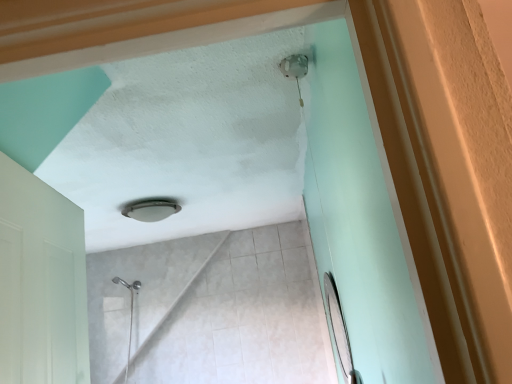
Identify the location of matte silver mirror at right. The width and height of the screenshot is (512, 384). (339, 329).

What is the approximate width of matte silver mirror at right?

It is 2.90 inches.

What do you see at coordinates (339, 329) in the screenshot? The height and width of the screenshot is (384, 512). I see `matte silver mirror at right` at bounding box center [339, 329].

What do you see at coordinates (151, 210) in the screenshot? I see `matte glass lamp at center` at bounding box center [151, 210].

Where is `matte glass lamp at center`? This screenshot has height=384, width=512. matte glass lamp at center is located at coordinates (151, 210).

This screenshot has width=512, height=384. I want to click on matte silver mirror at right, so click(339, 329).

Which is more to the left, matte glass lamp at center or matte silver mirror at right?

matte glass lamp at center is more to the left.

Considering the positions of objects matte glass lamp at center and matte silver mirror at right in the image provided, who is behind, matte glass lamp at center or matte silver mirror at right?

matte glass lamp at center is behind.

Which is closer to the camera, [138,212] or [337,320]?

The point [337,320] is in front.

From the image's perspective, who appears lower, matte glass lamp at center or matte silver mirror at right?

From the image's view, matte silver mirror at right is below.

In the scene shown: From a real-world perspective, is matte glass lamp at center physically located above or below matte silver mirror at right?

From a real-world perspective, matte glass lamp at center is physically above matte silver mirror at right.

Considering the sizes of objects matte glass lamp at center and matte silver mirror at right in the image provided, who is wider, matte glass lamp at center or matte silver mirror at right?

With larger width is matte glass lamp at center.

Is matte glass lamp at center taller than matte silver mirror at right?

No, matte glass lamp at center is not taller than matte silver mirror at right.

Considering the relative sizes of matte glass lamp at center and matte silver mirror at right in the image provided, is matte glass lamp at center bigger than matte silver mirror at right?

Incorrect, matte glass lamp at center is not larger than matte silver mirror at right.

Is matte glass lamp at center outside of matte silver mirror at right?

Absolutely, matte glass lamp at center is external to matte silver mirror at right.

Can you see matte glass lamp at center touching matte silver mirror at right?

matte glass lamp at center and matte silver mirror at right are clearly separated.

Is matte glass lamp at center oriented away from matte silver mirror at right?

That's not correct — matte glass lamp at center is not looking away from matte silver mirror at right.

Can you tell me how much matte glass lamp at center and matte silver mirror at right differ in facing direction?

The facing directions of matte glass lamp at center and matte silver mirror at right are 91.5 degrees apart.

How far apart are matte glass lamp at center and matte silver mirror at right?

matte glass lamp at center is 1.03 meters away from matte silver mirror at right.

Locate an element on the screen. lamp that is above the matte silver mirror at right (from the image's perspective) is located at coordinates (151, 210).

Is matte silver mirror at right to the left or to the right of matte glass lamp at center in the image?

Based on their positions, matte silver mirror at right is located to the right of matte glass lamp at center.

From the picture: Does matte silver mirror at right lie in front of matte glass lamp at center?

That is True.

Is point (350, 377) behind point (170, 212)?

No, (350, 377) is in front of (170, 212).

From the image's perspective, is matte silver mirror at right over matte glass lamp at center?

Incorrect, from the image's perspective, matte silver mirror at right is lower than matte glass lamp at center.

From a real-world perspective, does matte silver mirror at right stand above matte glass lamp at center?

No, from a real-world perspective, matte silver mirror at right is not over matte glass lamp at center

Does matte silver mirror at right have a greater width compared to matte glass lamp at center?

No, matte silver mirror at right is not wider than matte glass lamp at center.

In terms of height, does matte silver mirror at right look taller or shorter compared to matte glass lamp at center?

Clearly, matte silver mirror at right is taller compared to matte glass lamp at center.

Based on the photo, considering the sizes of objects matte silver mirror at right and matte glass lamp at center in the image provided, who is smaller, matte silver mirror at right or matte glass lamp at center?

matte glass lamp at center is smaller.

Is matte silver mirror at right outside of matte glass lamp at center?

Yes, matte silver mirror at right is located beyond the bounds of matte glass lamp at center.

Is matte silver mirror at right positioned far away from matte glass lamp at center?

Absolutely, matte silver mirror at right is distant from matte glass lamp at center.

Is matte silver mirror at right oriented towards matte glass lamp at center?

No, matte silver mirror at right does not turn towards matte glass lamp at center.

Can you tell me how much matte silver mirror at right and matte glass lamp at center differ in facing direction?

91.5 degrees.

Locate an element on the screen. This screenshot has width=512, height=384. lamp behind the matte silver mirror at right is located at coordinates (151, 210).

This screenshot has height=384, width=512. In order to click on lamp on the left of matte silver mirror at right in this screenshot , I will do `click(151, 210)`.

Where is `lamp above the matte silver mirror at right (from the image's perspective)`? This screenshot has width=512, height=384. lamp above the matte silver mirror at right (from the image's perspective) is located at coordinates (151, 210).